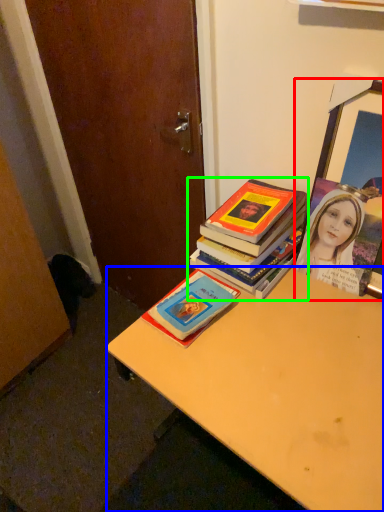
Question: Estimate the real-world distances between objects in this image. Which object is closer to picture frame (highlighted by a red box), desk (highlighted by a blue box) or book (highlighted by a green box)?

Choices:
 (A) desk
 (B) book

Answer: (B)